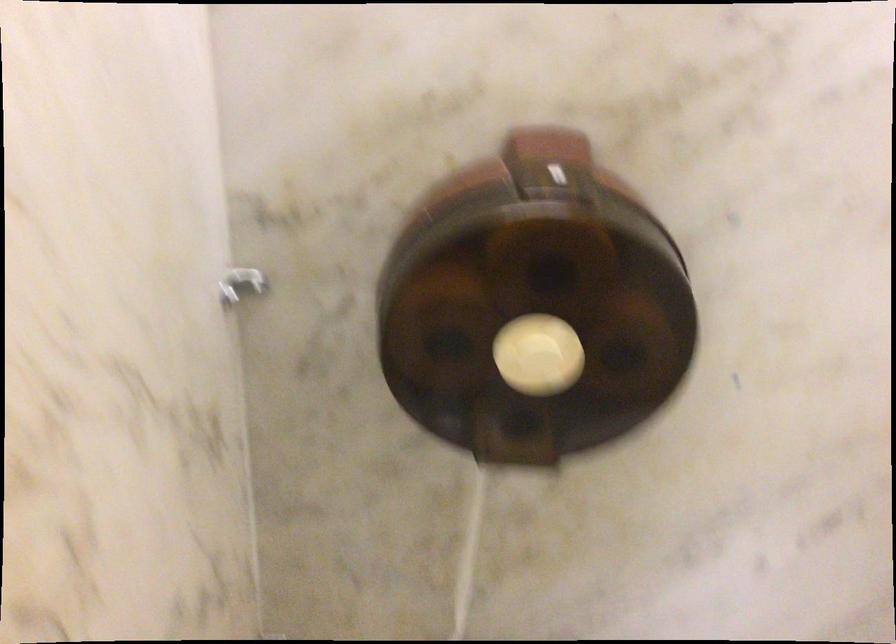
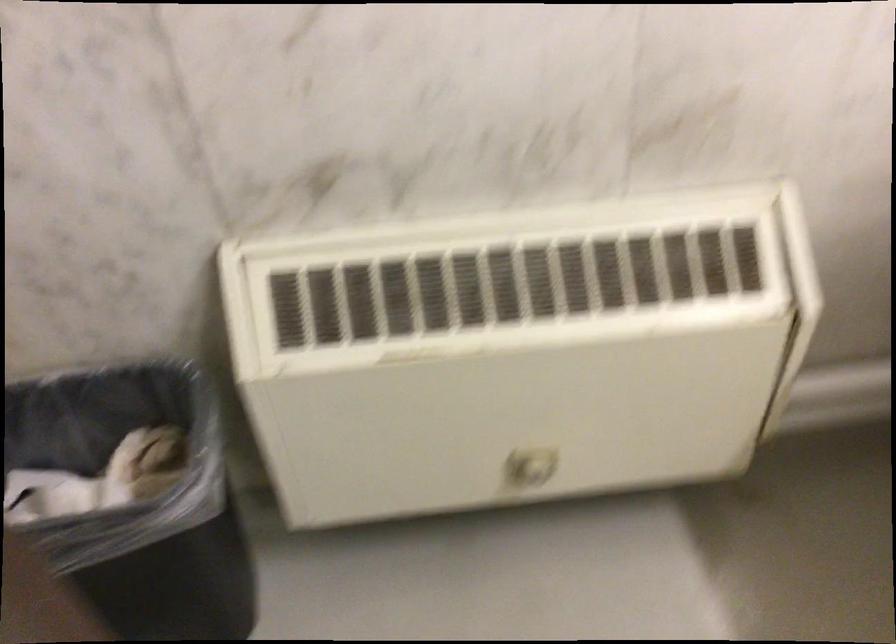
In the scene shown: Based on the continuous images, in which direction is the camera rotating?

The rotation direction of the camera is right-down.